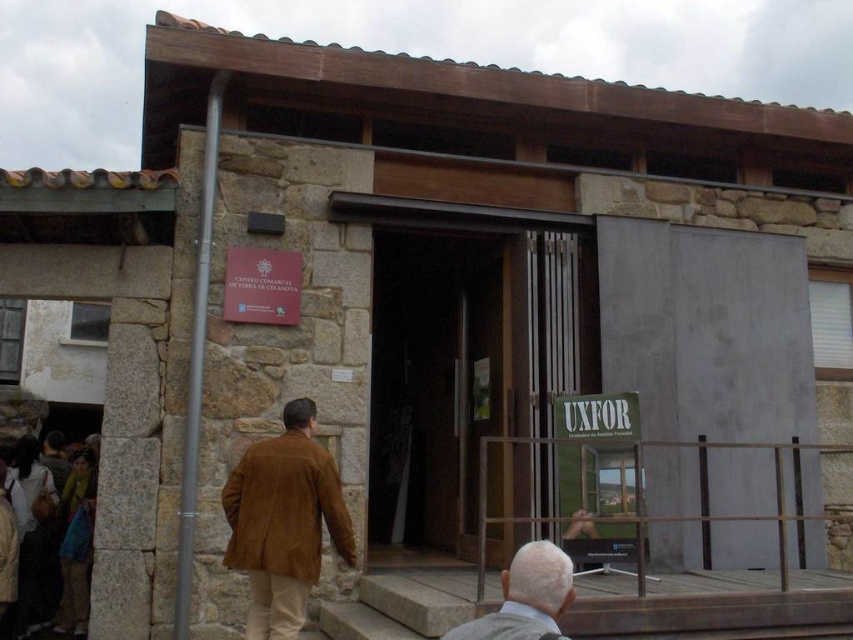
Based on the photo, does dark wood door at center appear over suede brown jacket at left?

Correct, dark wood door at center is located above suede brown jacket at left.

Is dark wood door at center positioned behind suede brown jacket at left?

Yes.

Does point (398, 504) lie behind point (271, 465)?

Yes.

Locate an element on the screen. dark wood door at center is located at coordinates (431, 385).

Is dark wood door at center taller than gray suede jacket at lower center?

Indeed, dark wood door at center has a greater height compared to gray suede jacket at lower center.

Who is more forward, [412,268] or [502,572]?

Point [502,572]

Locate an element on the screen. Image resolution: width=853 pixels, height=640 pixels. dark wood door at center is located at coordinates (431, 385).

Can you confirm if suede brown jacket at left is smaller than gray suede jacket at lower center?

Actually, suede brown jacket at left might be larger than gray suede jacket at lower center.

Which is more to the right, suede brown jacket at left or gray suede jacket at lower center?

gray suede jacket at lower center is more to the right.

At what (x,y) coordinates should I click in order to perform the action: click on suede brown jacket at left. Please return your answer as a coordinate pair (x, y). Looking at the image, I should click on (283, 522).